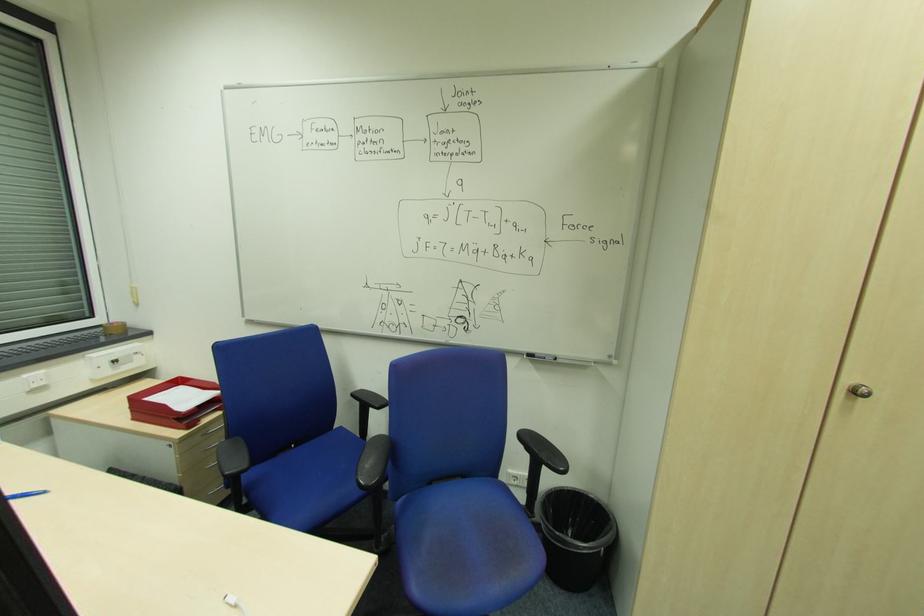
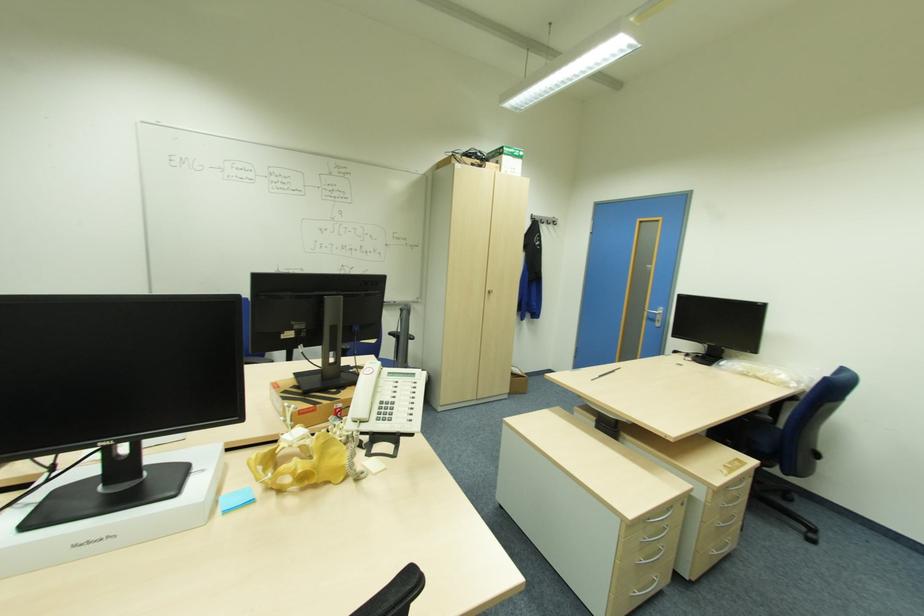
Question: I am providing you with two images of the same scene from different viewpoints. After the viewpoint changes to image2, which objects are now occluded?

Choices:
 (A) silver drawer handle
 (B) black pen
 (C) blue pen
 (D) orange plastic colander

Answer: (C)